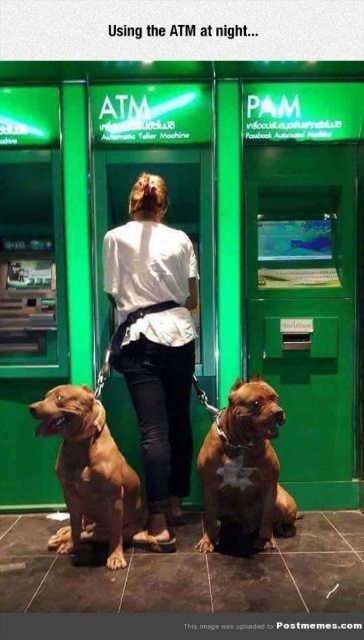
You are standing at the point labeled point (66, 403) and want to move to point (255, 532). Given that you can only move forward in a straight line, will you pass through any objects along the way?

Since point (66, 403) is closer to the viewer than point (255, 532), moving forward in a straight line from point (66, 403) to point (255, 532) would require moving away from the viewer. However, the scene shows the woman interacting with an ATM with two dogs on leashes nearby. There are no objects blocking the path between these two points as described in the scene, so you would not pass through any objects.

You are a security camera monitoring the ATM area. You notice a person wearing a white matte shirt at center and brown shiny fur at lower center. According to the spatial arrangement, which object is positioned to the left?

The brown shiny fur at lower center is positioned to the left of the white matte shirt at center.